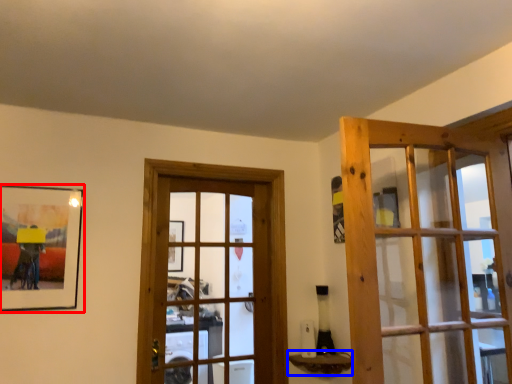
Question: Which of the following is the farthest to the observer, picture frame (highlighted by a red box) or window sill (highlighted by a blue box)?

Choices:
 (A) picture frame
 (B) window sill

Answer: (B)